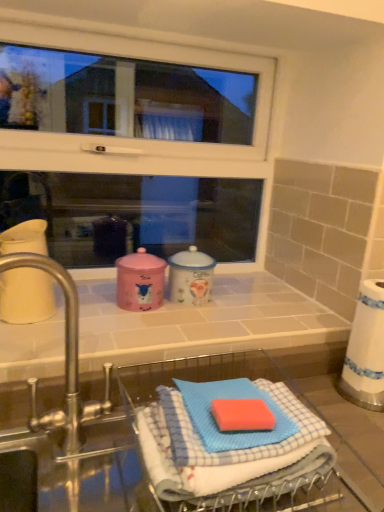
Question: Does white glossy window at upper center have a greater width compared to white glossy counter top at center?

Choices:
 (A) yes
 (B) no

Answer: (B)

Question: Does white glossy window at upper center have a smaller size compared to white glossy counter top at center?

Choices:
 (A) yes
 (B) no

Answer: (B)

Question: Is white glossy window at upper center taller than white glossy counter top at center?

Choices:
 (A) yes
 (B) no

Answer: (A)

Question: Is white glossy window at upper center located outside white glossy counter top at center?

Choices:
 (A) yes
 (B) no

Answer: (A)

Question: Does white glossy window at upper center contain white glossy counter top at center?

Choices:
 (A) no
 (B) yes

Answer: (A)

Question: Is white glossy window at upper center touching white glossy counter top at center?

Choices:
 (A) no
 (B) yes

Answer: (A)

Question: From the image's perspective, is silver metallic tap at left on white glossy window at upper center?

Choices:
 (A) no
 (B) yes

Answer: (A)

Question: From a real-world perspective, is silver metallic tap at left located beneath white glossy window at upper center?

Choices:
 (A) yes
 (B) no

Answer: (A)

Question: Can you confirm if silver metallic tap at left is wider than white glossy window at upper center?

Choices:
 (A) yes
 (B) no

Answer: (A)

Question: Is white glossy window at upper center located within silver metallic tap at left?

Choices:
 (A) yes
 (B) no

Answer: (B)

Question: From a real-world perspective, is silver metallic tap at left positioned over white glossy window at upper center based on gravity?

Choices:
 (A) no
 (B) yes

Answer: (A)

Question: Is silver metallic tap at left facing towards white glossy window at upper center?

Choices:
 (A) no
 (B) yes

Answer: (A)

Question: Can you confirm if white glossy window at upper center is positioned to the left of blue checkered cloth at lower center?

Choices:
 (A) no
 (B) yes

Answer: (B)